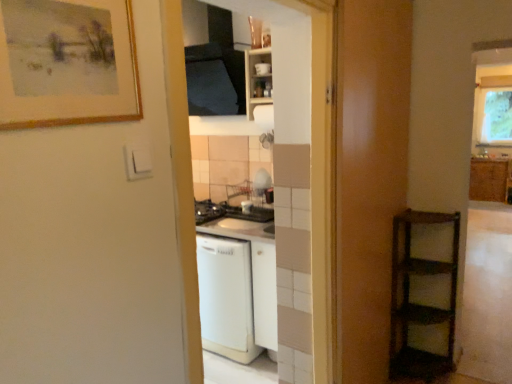
Question: From the image's perspective, is white matte dishwasher at center above or below wooden shelf at right, the 2th screen door positioned from the left?

Choices:
 (A) below
 (B) above

Answer: (A)

Question: Relative to wooden shelf at right, the 2th screen door positioned from the left, is white matte dishwasher at center in front or behind?

Choices:
 (A) front
 (B) behind

Answer: (B)

Question: Based on their relative distances, which object is nearer to the wooden cabinet at right, placed as the second cabinetry when sorted from front to back?

Choices:
 (A) white glossy dishwasher at center, marked as the first screen door in a left-to-right arrangement
 (B) white matte dishwasher at center
 (C) clear glass window at upper right
 (D) wooden shelf at right, positioned as the first screen door in right-to-left order
 (E) white matte cabinet at upper center, marked as the 2th cabinetry in a back-to-front arrangement

Answer: (C)

Question: Which object is positioned farthest from the clear glass window at upper right?

Choices:
 (A) wooden-framed painting at upper left
 (B) white glossy dishwasher at center, the 2th screen door when ordered from right to left
 (C) white matte dishwasher at center
 (D) wooden cabinet at right, the second cabinetry viewed from the left
 (E) wooden shelf at right, the 2th screen door positioned from the left

Answer: (A)